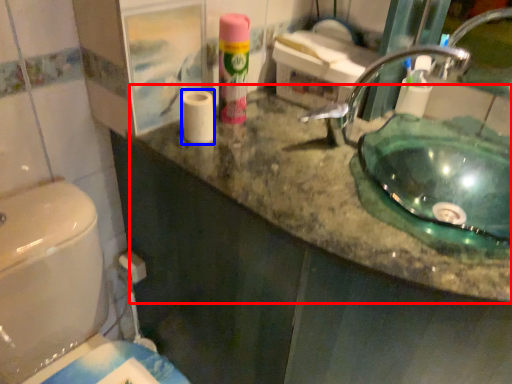
Question: Among these objects, which one is farthest to the camera, counter top (highlighted by a red box) or toilet paper (highlighted by a blue box)?

Choices:
 (A) counter top
 (B) toilet paper

Answer: (B)